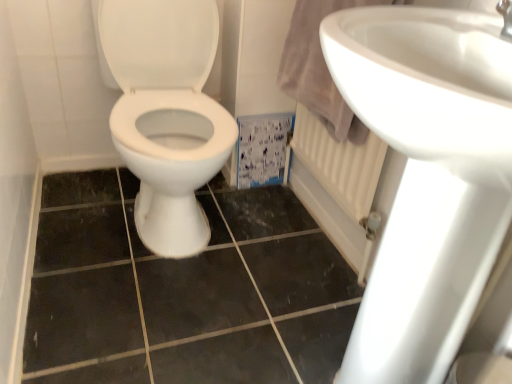
Question: Is point (381, 327) closer or farther from the camera than point (247, 289)?

Choices:
 (A) closer
 (B) farther

Answer: (A)

Question: From the image's perspective, is white glossy sink at upper right located above or below black ceramic tile at center?

Choices:
 (A) above
 (B) below

Answer: (A)

Question: In the image, is white glossy sink at upper right positioned in front of or behind black ceramic tile at center?

Choices:
 (A) front
 (B) behind

Answer: (A)

Question: From the image's perspective, is black ceramic tile at center above or below white glossy sink at upper right?

Choices:
 (A) above
 (B) below

Answer: (B)

Question: Looking at their shapes, would you say black ceramic tile at center is wider or thinner than white glossy sink at upper right?

Choices:
 (A) thin
 (B) wide

Answer: (B)

Question: Relative to white glossy sink at upper right, is black ceramic tile at center in front or behind?

Choices:
 (A) behind
 (B) front

Answer: (A)

Question: Is point (92, 297) positioned closer to the camera than point (407, 46)?

Choices:
 (A) farther
 (B) closer

Answer: (A)